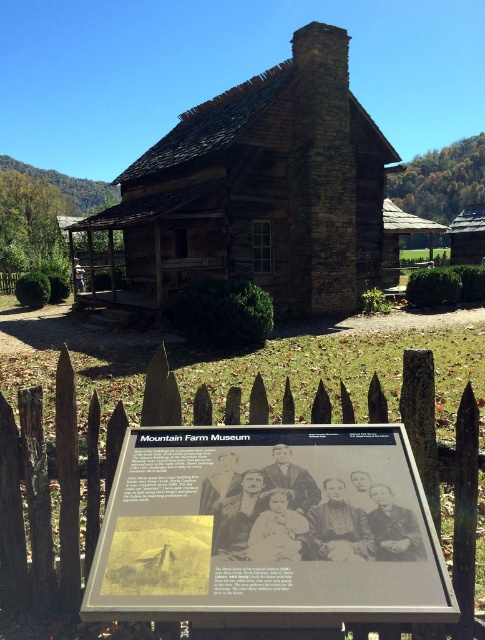
You are standing at the point with coordinates point (258, 189) in the image. What structure are you directly facing?

The point (258, 189) corresponds to the rustic wood cabin at center, so you are directly facing the rustic wood cabin at center.